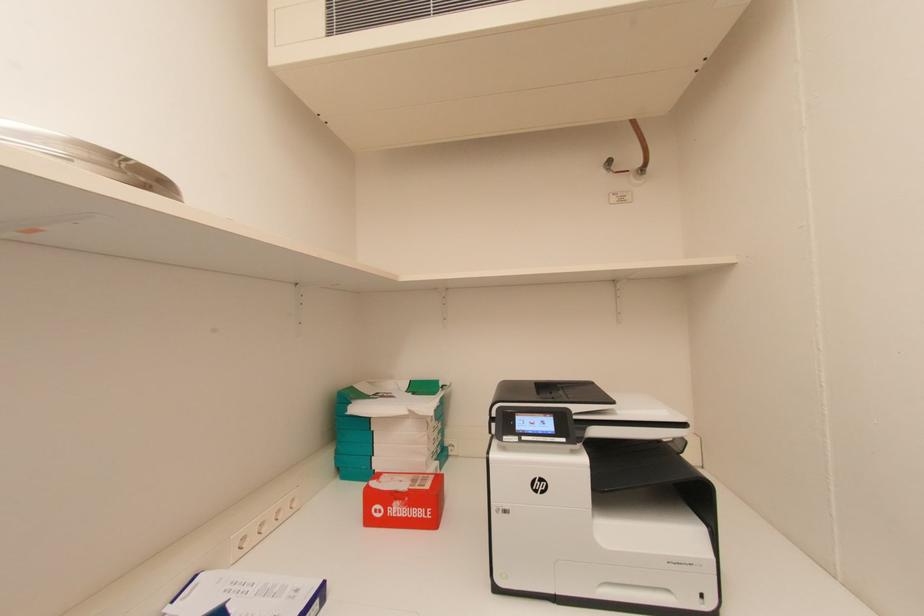
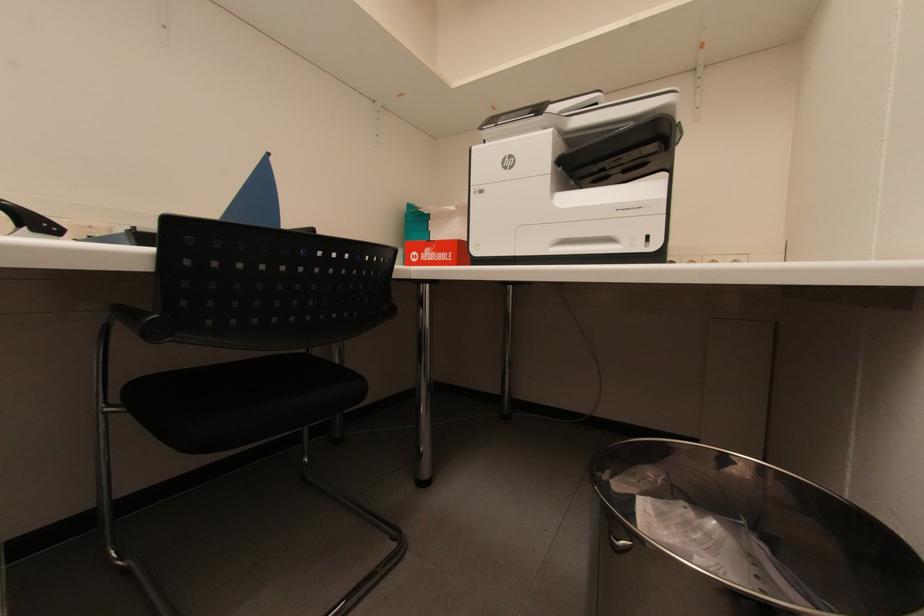
Question: What movement of the cameraman would produce the second image?

Choices:
 (A) Left
 (B) Right
 (C) Forward
 (D) Backward

Answer: (B)